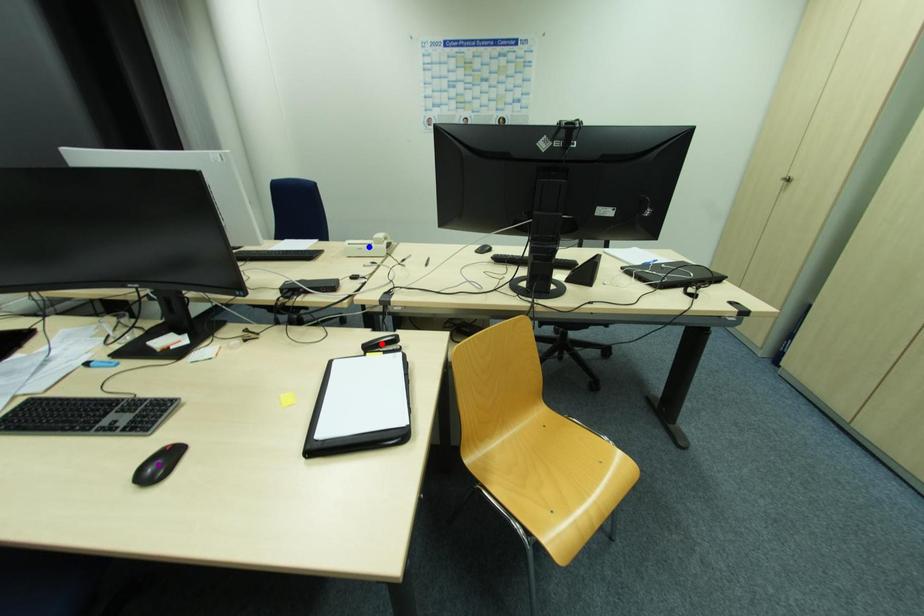
Order these from nearest to farthest:
blue point | purple point | red point

blue point
red point
purple point